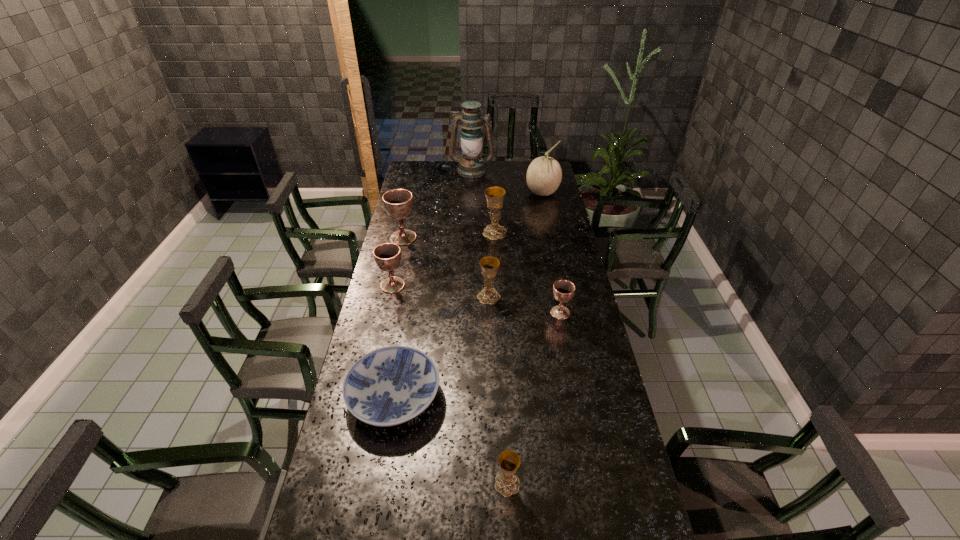
I want to click on free space located 0.290m on the back of the rightmost chalice, so click(550, 259).

What are the coordinates of `vacant space situated 0.210m on the left of the smallest gold chalice` in the screenshot? It's located at (419, 484).

I want to click on free point located 0.220m on the front of the plate, so click(373, 517).

The image size is (960, 540). I want to click on object present at the far edge, so click(471, 166).

The width and height of the screenshot is (960, 540). I want to click on plate located at the left edge, so click(388, 386).

Locate an element on the screen. This screenshot has height=540, width=960. cantaloup that is at the right edge is located at coordinates (544, 174).

Where is `chalice that is at the right edge`? Image resolution: width=960 pixels, height=540 pixels. chalice that is at the right edge is located at coordinates 563,290.

This screenshot has height=540, width=960. What are the coordinates of `free space at the far edge of the desktop` in the screenshot? It's located at (516, 172).

The height and width of the screenshot is (540, 960). I want to click on vacant space at the left edge of the desktop, so click(354, 471).

Locate an element on the screen. The height and width of the screenshot is (540, 960). vacant area at the right edge is located at coordinates (573, 265).